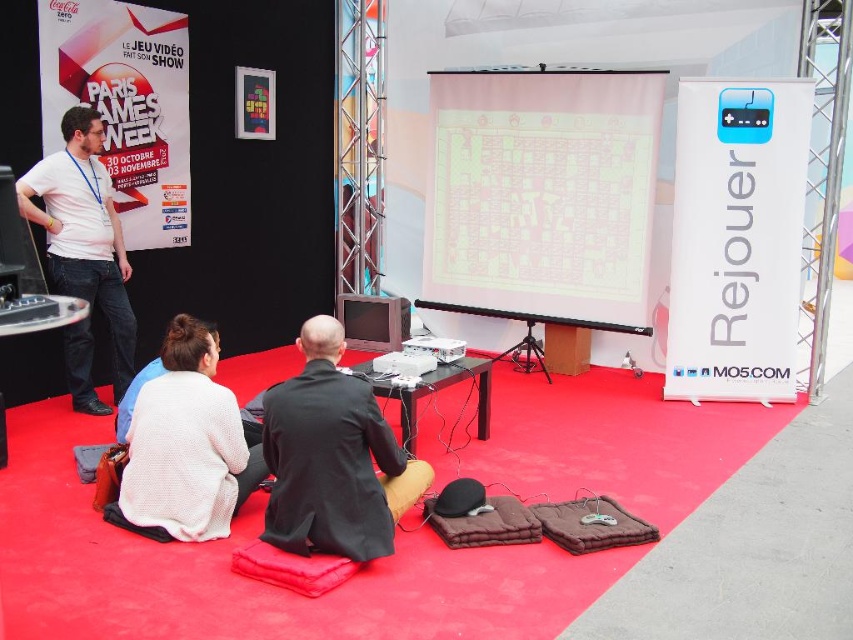
You are organizing a photo shoot at the Paris Games Week event. You need to decide which item to place in the foreground to highlight the gaming equipment on the table. Which object should you choose between the black fabric at center and the white knitted sweater at lower left, considering their sizes?

The black fabric at center has a smaller size compared to the white knitted sweater at lower left. To highlight the gaming equipment on the table, you should choose the smaller item so it doesn not obstruct the view. Therefore, the black fabric at center is the better choice.